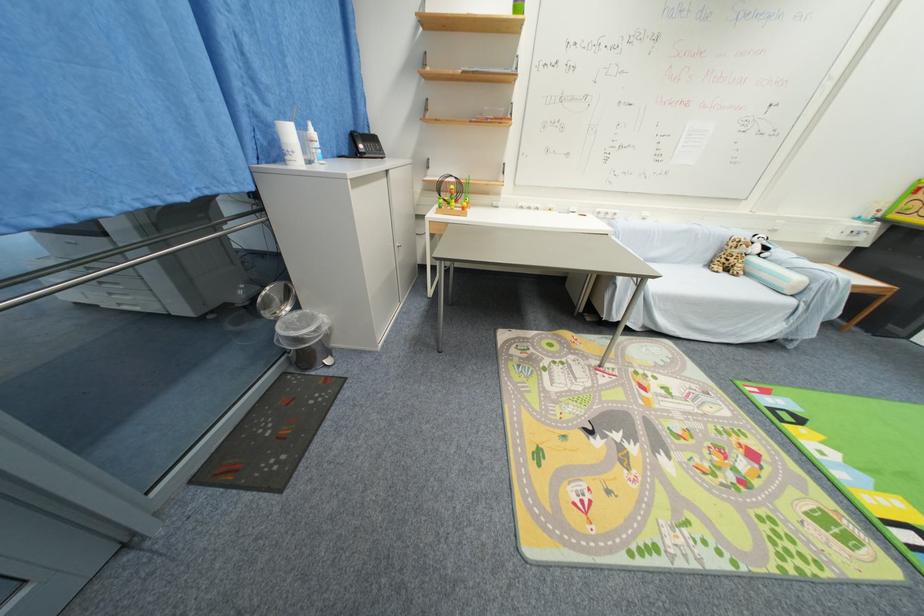
Image resolution: width=924 pixels, height=616 pixels. What do you see at coordinates (397, 245) in the screenshot? I see `the silver cabinet handle` at bounding box center [397, 245].